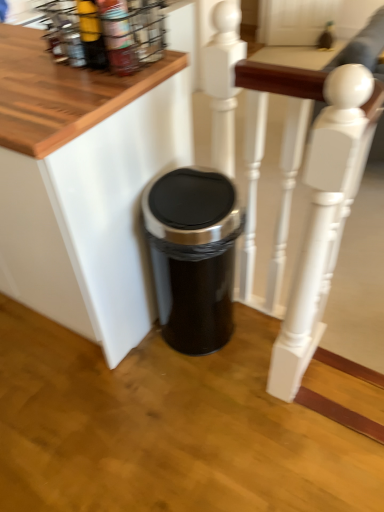
Locate an element on the screen. This screenshot has width=384, height=512. free spot in front of black metallic trash can at center is located at coordinates (200, 390).